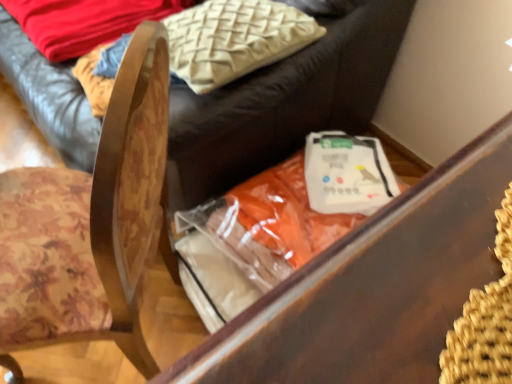
Question: From the image's perspective, would you say white matte plastic bag at center is shown under beige textured pillow at upper center?

Choices:
 (A) yes
 (B) no

Answer: (A)

Question: Could you tell me if white matte plastic bag at center is facing beige textured pillow at upper center?

Choices:
 (A) no
 (B) yes

Answer: (A)

Question: From a real-world perspective, is white matte plastic bag at center positioned over beige textured pillow at upper center based on gravity?

Choices:
 (A) no
 (B) yes

Answer: (A)

Question: Considering the relative sizes of white matte plastic bag at center and beige textured pillow at upper center in the image provided, is white matte plastic bag at center wider than beige textured pillow at upper center?

Choices:
 (A) yes
 (B) no

Answer: (B)

Question: Is white matte plastic bag at center far away from beige textured pillow at upper center?

Choices:
 (A) yes
 (B) no

Answer: (B)

Question: Is white matte plastic bag at center bigger than beige textured pillow at upper center?

Choices:
 (A) no
 (B) yes

Answer: (A)

Question: Can you confirm if beige textured pillow at upper center is positioned to the left of wooden chair at lower left, the first furniture viewed from the top?

Choices:
 (A) yes
 (B) no

Answer: (B)

Question: Does beige textured pillow at upper center have a lesser width compared to wooden chair at lower left, the first furniture viewed from the top?

Choices:
 (A) yes
 (B) no

Answer: (A)

Question: Is beige textured pillow at upper center taller than wooden chair at lower left, the second furniture ordered from the bottom?

Choices:
 (A) no
 (B) yes

Answer: (A)

Question: Can you confirm if beige textured pillow at upper center is wider than wooden chair at lower left, the second furniture ordered from the bottom?

Choices:
 (A) no
 (B) yes

Answer: (A)

Question: From a real-world perspective, is beige textured pillow at upper center below wooden chair at lower left, the second furniture ordered from the bottom?

Choices:
 (A) no
 (B) yes

Answer: (A)

Question: Can you confirm if beige textured pillow at upper center is smaller than wooden chair at lower left, the second furniture ordered from the bottom?

Choices:
 (A) no
 (B) yes

Answer: (B)

Question: Is beige textured pillow at upper center shorter than wooden chair at center?

Choices:
 (A) yes
 (B) no

Answer: (A)